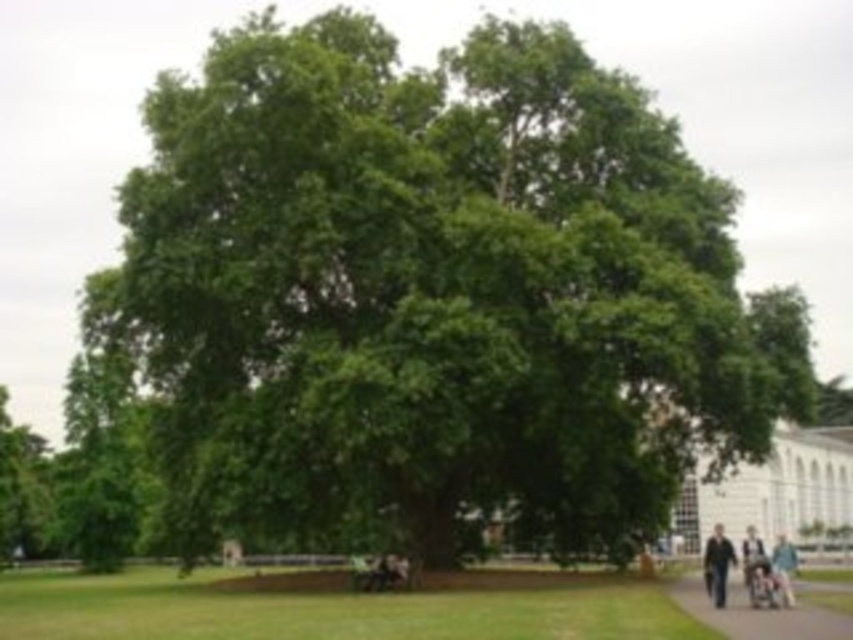
Does point (810, 632) come farther from viewer compared to point (769, 589)?

No, (810, 632) is closer to viewer.

Between point (689, 596) and point (747, 572), which one is positioned in front?

Point (747, 572)

Find the location of a particular element. The height and width of the screenshot is (640, 853). smooth asphalt path at lower right is located at coordinates (757, 612).

At what (x,y) coordinates should I click in order to perform the action: click on smooth asphalt path at lower right. Please return your answer as a coordinate pair (x, y). Looking at the image, I should click on (757, 612).

Which is more to the left, green grass at lower center or light blue jeans at lower right?

green grass at lower center

Does green grass at lower center appear on the right side of light blue jeans at lower right?

In fact, green grass at lower center is to the left of light blue jeans at lower right.

Is point (247, 573) positioned in front of point (782, 552)?

That is False.

Where is `green grass at lower center`? green grass at lower center is located at coordinates (335, 605).

Who is lower down, green grass at lower center or dark blue jeans at lower right?

green grass at lower center

Does green grass at lower center have a greater height compared to dark blue jeans at lower right?

Indeed, green grass at lower center has a greater height compared to dark blue jeans at lower right.

This screenshot has height=640, width=853. What do you see at coordinates (335, 605) in the screenshot?
I see `green grass at lower center` at bounding box center [335, 605].

What are the coordinates of `green grass at lower center` in the screenshot? It's located at (335, 605).